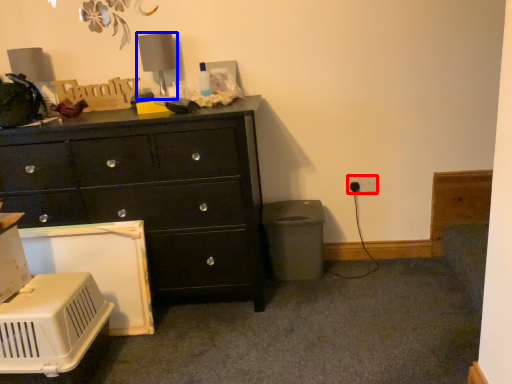
Question: Which of the following is the closest to the observer, electric outlet (highlighted by a red box) or table lamp (highlighted by a blue box)?

Choices:
 (A) electric outlet
 (B) table lamp

Answer: (B)